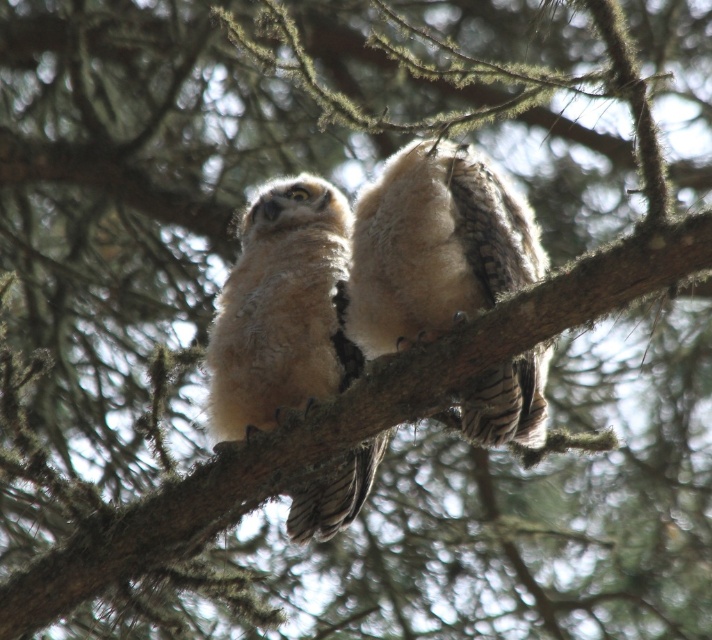
Is fuzzy white owl at center closer to the viewer compared to fuzzy beige owl at center?

Yes, fuzzy white owl at center is in front of fuzzy beige owl at center.

Does fuzzy white owl at center appear under fuzzy beige owl at center?

Actually, fuzzy white owl at center is above fuzzy beige owl at center.

The width and height of the screenshot is (712, 640). Describe the element at coordinates (434, 244) in the screenshot. I see `fuzzy white owl at center` at that location.

Image resolution: width=712 pixels, height=640 pixels. I want to click on fuzzy white owl at center, so click(x=434, y=244).